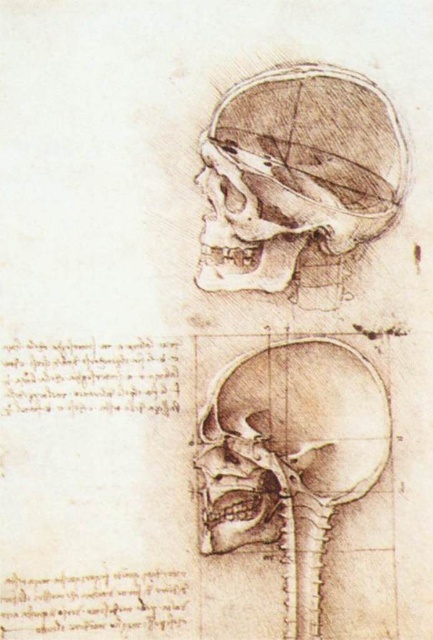
Is graphite pencil skull at upper center further to camera compared to brown pencil sketch skull at center?

Yes, graphite pencil skull at upper center is further from the viewer.

Is graphite pencil skull at upper center above brown pencil sketch skull at center?

Yes.

In order to click on graphite pencil skull at upper center in this screenshot , I will do `click(296, 176)`.